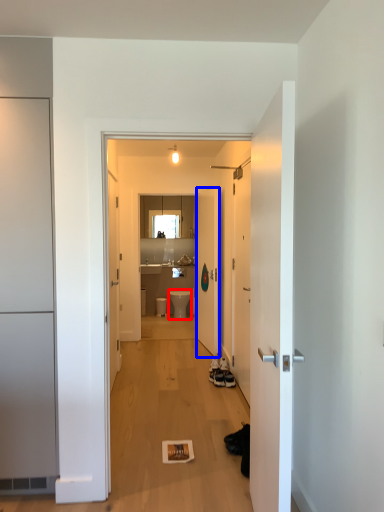
Question: Among these objects, which one is nearest to the camera, toilet (highlighted by a red box) or door (highlighted by a blue box)?

Choices:
 (A) toilet
 (B) door

Answer: (B)